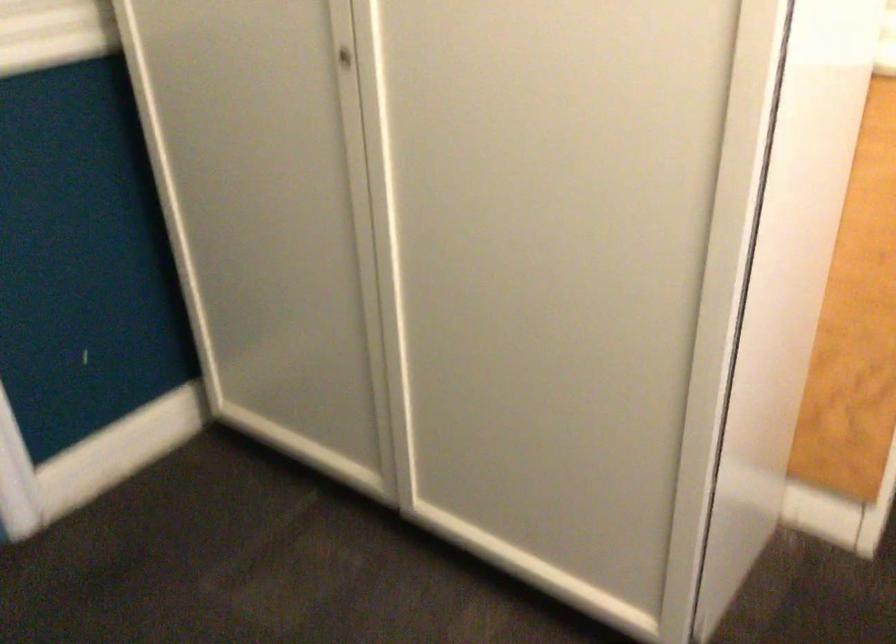
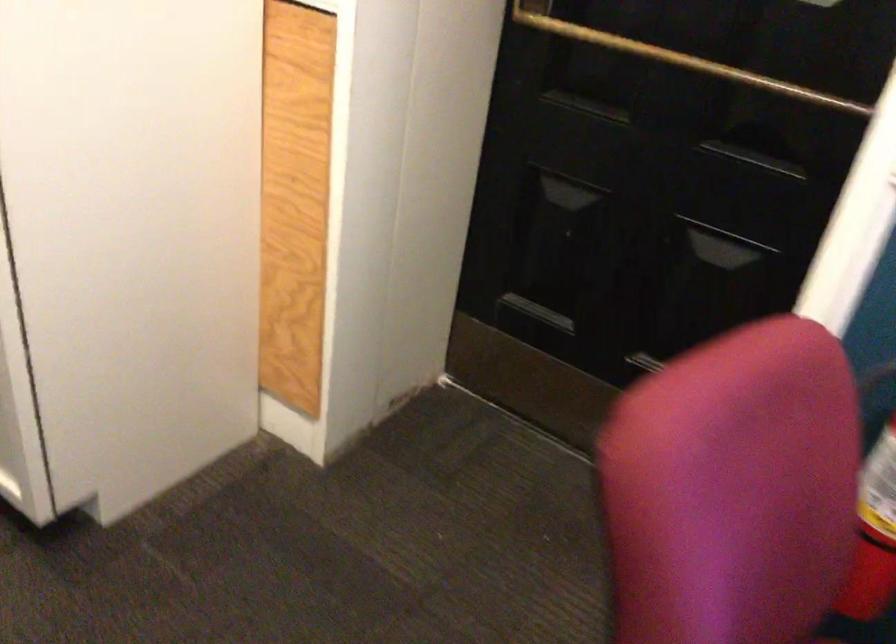
Question: Which direction would the cameraman need to move to produce the second image? Reply with the corresponding letter.

Choices:
 (A) Left
 (B) Right
 (C) Forward
 (D) Backward

Answer: (B)